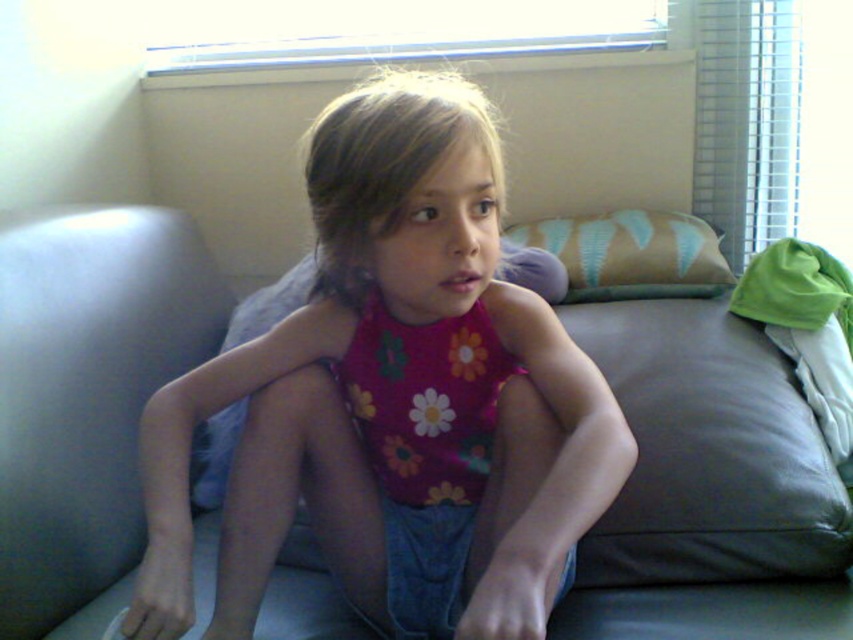
You are a photographer setting up for a portrait. You notice the floral tank top at center and the beige fabric pillow at upper right. Which object is closer to the camera based on their positions?

The floral tank top at center is positioned under the beige fabric pillow at upper right, meaning the beige fabric pillow at upper right is closer to the camera.

You are an interior designer assessing the color coordination of the room. The floral tank top at center and beige fabric pillow at upper right are both visible in the scene. Which item has a more prominent vertical size in the image?

The floral tank top at center has a greater height compared to the beige fabric pillow at upper right, making it more prominent vertically in the image.